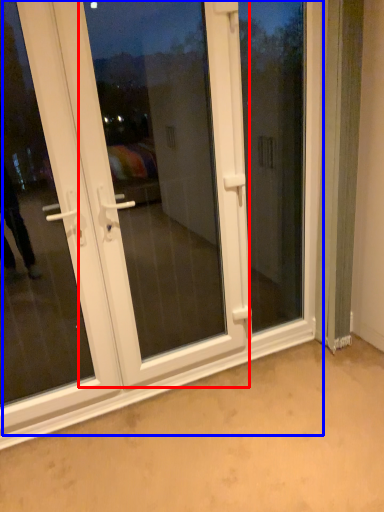
Question: Among these objects, which one is farthest to the camera, screen door (highlighted by a red box) or door (highlighted by a blue box)?

Choices:
 (A) screen door
 (B) door

Answer: (A)